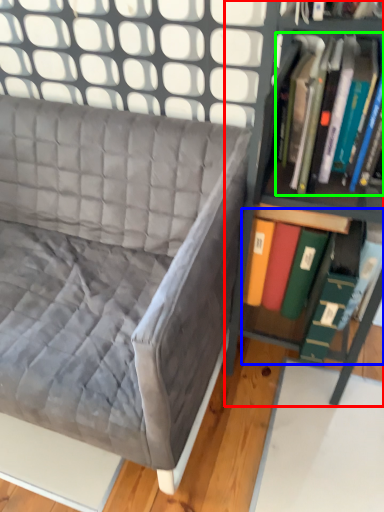
Question: Estimate the real-world distances between objects in this image. Which object is closer to shelf (highlighted by a red box), book (highlighted by a blue box) or book (highlighted by a green box)?

Choices:
 (A) book
 (B) book

Answer: (A)